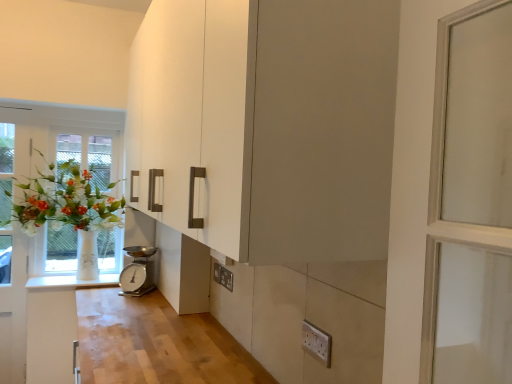
Question: Considering the positions of silver metallic scale at lower center and matte white cabinet at lower center in the image, is silver metallic scale at lower center taller or shorter than matte white cabinet at lower center?

Choices:
 (A) tall
 (B) short

Answer: (B)

Question: From the image's perspective, relative to matte white cabinet at lower center, is silver metallic scale at lower center above or below?

Choices:
 (A) below
 (B) above

Answer: (A)

Question: Which object is the closest to the white glossy counter top at lower left?

Choices:
 (A) white plastic electric outlet at lower right, which is the second electric outlet in left-to-right order
 (B) white glass vase at left
 (C) silver metallic scale at lower center
 (D) matte white cabinet at lower center
 (E) white plastic electric outlet at lower center, the first electric outlet when ordered from back to front

Answer: (C)

Question: Which object is positioned closest to the silver metallic scale at lower center?

Choices:
 (A) white glass vase at left
 (B) white glossy counter top at lower left
 (C) matte white cabinet at lower center
 (D) white plastic electric outlet at lower right, which is the 2th electric outlet from back to front
 (E) white plastic electric outlet at lower center, which is the second electric outlet from right to left

Answer: (B)